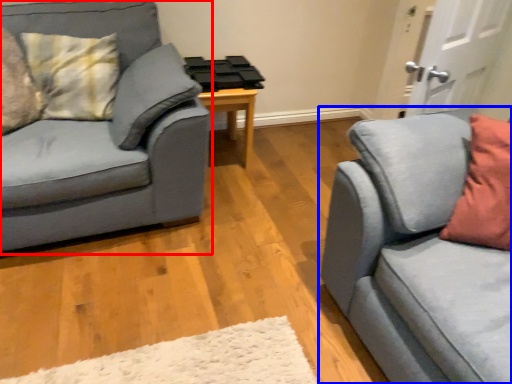
Question: Which point is further to the camera, studio couch (highlighted by a red box) or studio couch (highlighted by a blue box)?

Choices:
 (A) studio couch
 (B) studio couch

Answer: (A)